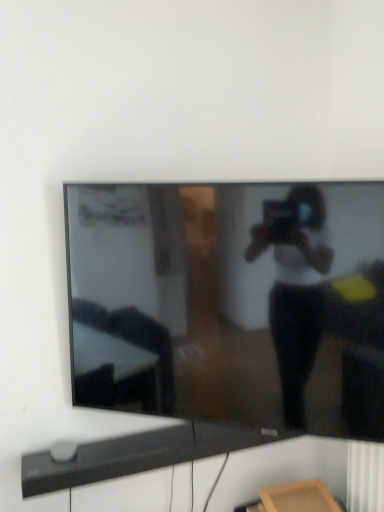
Question: Should I look upward or downward to see black matte soundbar at lower center?

Choices:
 (A) down
 (B) up

Answer: (A)

Question: Could black glossy tv at center be considered to be inside black matte soundbar at lower center?

Choices:
 (A) no
 (B) yes

Answer: (A)

Question: Is black matte soundbar at lower center thinner than black glossy tv at center?

Choices:
 (A) yes
 (B) no

Answer: (B)

Question: Is black matte soundbar at lower center bigger than black glossy tv at center?

Choices:
 (A) yes
 (B) no

Answer: (B)

Question: Is black matte soundbar at lower center taller than black glossy tv at center?

Choices:
 (A) no
 (B) yes

Answer: (A)

Question: From a real-world perspective, is black matte soundbar at lower center located beneath black glossy tv at center?

Choices:
 (A) yes
 (B) no

Answer: (A)

Question: Considering the relative sizes of black matte soundbar at lower center and black glossy tv at center in the image provided, is black matte soundbar at lower center shorter than black glossy tv at center?

Choices:
 (A) no
 (B) yes

Answer: (B)

Question: Considering the relative positions of black glossy tv at center and black matte soundbar at lower center in the image provided, is black glossy tv at center to the right of black matte soundbar at lower center from the viewer's perspective?

Choices:
 (A) no
 (B) yes

Answer: (B)

Question: Considering the relative sizes of black glossy tv at center and black matte soundbar at lower center in the image provided, is black glossy tv at center taller than black matte soundbar at lower center?

Choices:
 (A) no
 (B) yes

Answer: (B)

Question: Is black glossy tv at center not close to black matte soundbar at lower center?

Choices:
 (A) no
 (B) yes

Answer: (A)

Question: From the image's perspective, does black glossy tv at center appear higher than black matte soundbar at lower center?

Choices:
 (A) yes
 (B) no

Answer: (A)

Question: Is black glossy tv at center shorter than black matte soundbar at lower center?

Choices:
 (A) no
 (B) yes

Answer: (A)

Question: Is black glossy tv at center at the left side of black matte soundbar at lower center?

Choices:
 (A) no
 (B) yes

Answer: (A)

Question: From the image's perspective, is black glossy tv at center above or below black matte soundbar at lower center?

Choices:
 (A) below
 (B) above

Answer: (B)